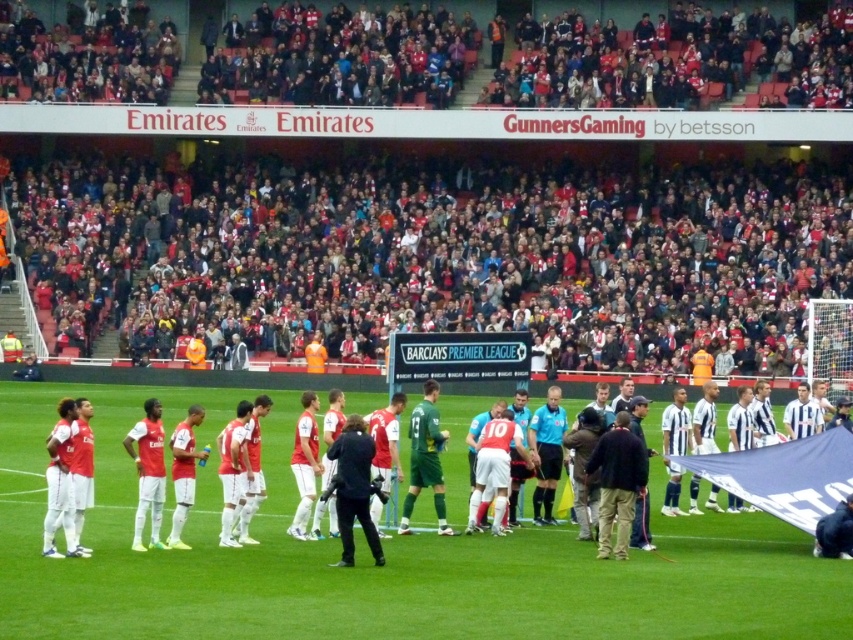
Is matte red jersey at left to the right of dark blue jersey at center from the viewer's perspective?

In fact, matte red jersey at left is to the left of dark blue jersey at center.

Who is shorter, matte red jersey at left or dark blue jersey at center?

matte red jersey at left

The width and height of the screenshot is (853, 640). Describe the element at coordinates (784, 476) in the screenshot. I see `matte red jersey at left` at that location.

Find the location of a particular element. Image resolution: width=853 pixels, height=640 pixels. matte red jersey at left is located at coordinates (784, 476).

Does red fabric crowd at upper center have a greater height compared to green jersey at center?

Correct, red fabric crowd at upper center is much taller as green jersey at center.

Is the position of red fabric crowd at upper center more distant than that of green jersey at center?

Yes, red fabric crowd at upper center is further from the viewer.

Is point (737, 132) more distant than point (415, 493)?

Yes, it is behind point (415, 493).

I want to click on red fabric crowd at upper center, so click(454, 195).

Image resolution: width=853 pixels, height=640 pixels. In order to click on matte red jersey at left in this screenshot , I will do `click(784, 476)`.

Is point (770, 458) farther from camera compared to point (337, 522)?

Yes, point (770, 458) is farther from viewer.

Where is `matte red jersey at left`? matte red jersey at left is located at coordinates (784, 476).